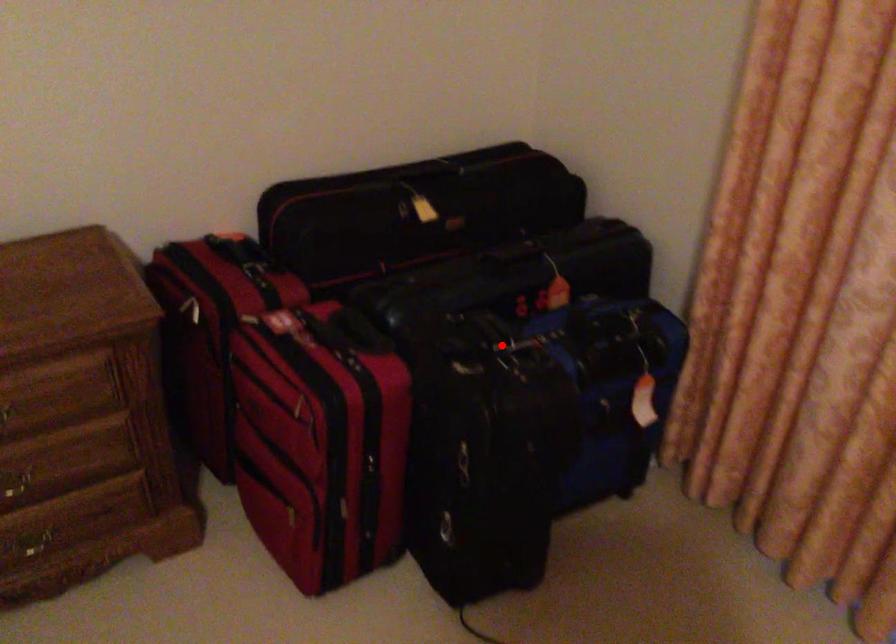
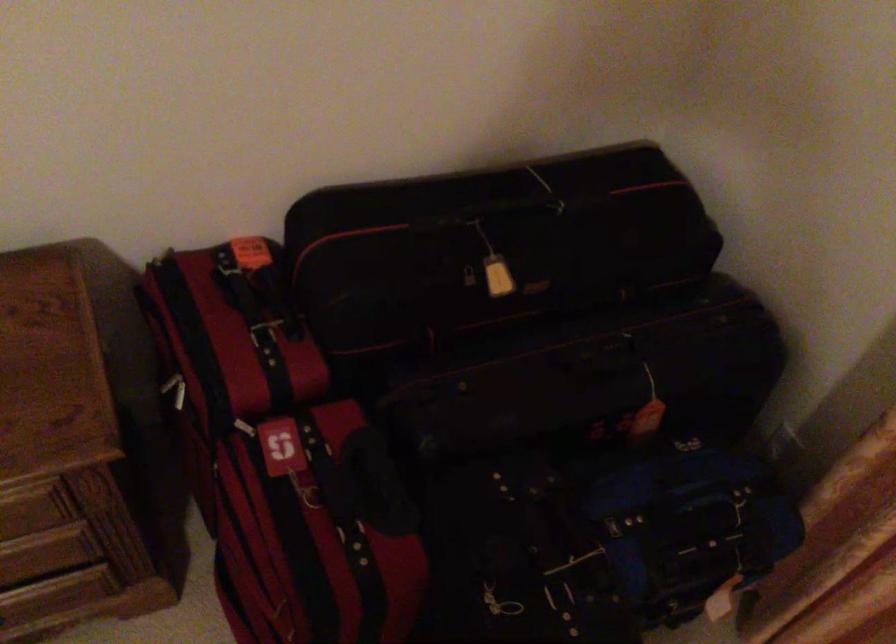
Where in the second image is the point corresponding to the highlighted location from the first image?

(556, 552)